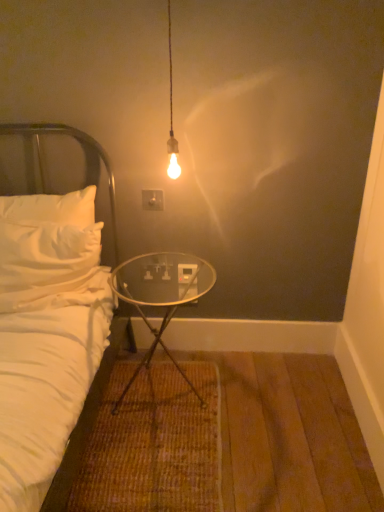
Question: Considering the positions of white fabric headboard at left and white plastic electric outlet at center in the image, is white fabric headboard at left taller or shorter than white plastic electric outlet at center?

Choices:
 (A) short
 (B) tall

Answer: (B)

Question: Is point (112, 211) positioned closer to the camera than point (145, 202)?

Choices:
 (A) closer
 (B) farther

Answer: (B)

Question: Which object is the farthest from the white plastic electric outlet at center?

Choices:
 (A) white fabric headboard at left
 (B) transparent glass table at center

Answer: (B)

Question: Which of these objects is positioned farthest from the white fabric headboard at left?

Choices:
 (A) white plastic electric outlet at center
 (B) transparent glass table at center

Answer: (B)